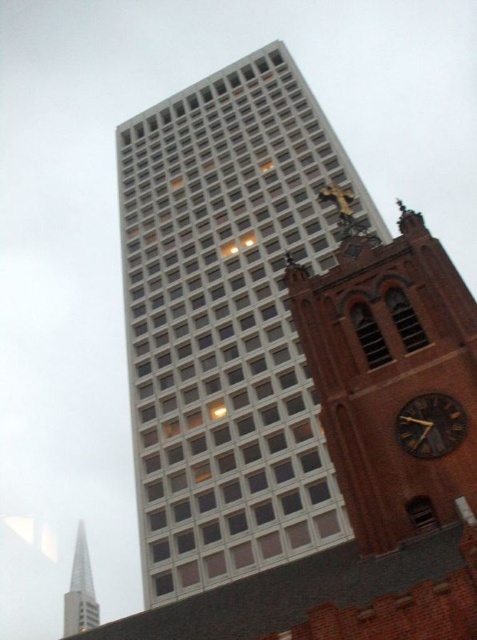
Question: Is white glass building at center closer to camera compared to dark brown wooden clock at right?

Choices:
 (A) yes
 (B) no

Answer: (B)

Question: Does brown brick clock tower at right come behind dark brown wooden clock at right?

Choices:
 (A) no
 (B) yes

Answer: (A)

Question: Which object is the farthest from the dark brown wooden clock at right?

Choices:
 (A) white glass building at center
 (B) shiny silver spire at lower left
 (C) brown brick clock tower at right

Answer: (B)

Question: Which point is farther to the camera?

Choices:
 (A) brown brick clock tower at right
 (B) dark brown wooden clock at right

Answer: (B)

Question: Among these objects, which one is farthest from the camera?

Choices:
 (A) brown brick clock tower at right
 (B) white glass building at center
 (C) dark brown wooden clock at right

Answer: (B)

Question: Considering the relative positions of brown brick clock tower at right and dark brown wooden clock at right in the image provided, where is brown brick clock tower at right located with respect to dark brown wooden clock at right?

Choices:
 (A) right
 (B) left

Answer: (B)